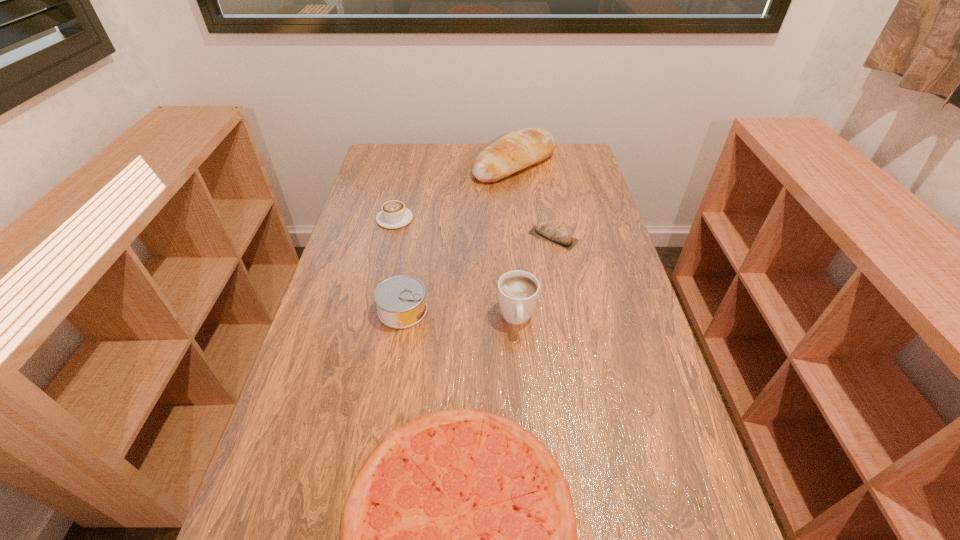
At what (x,y) coordinates should I click in order to perform the action: click on bread. Please return your answer as a coordinate pair (x, y). The height and width of the screenshot is (540, 960). Looking at the image, I should click on (517, 150).

Find the location of a particular element. This screenshot has height=540, width=960. the nearer cappuccino is located at coordinates (518, 291).

In order to click on the right cappuccino in this screenshot , I will do `click(518, 291)`.

Where is `can`? This screenshot has width=960, height=540. can is located at coordinates (400, 300).

This screenshot has height=540, width=960. Find the location of `the farther cappuccino`. the farther cappuccino is located at coordinates (393, 214).

Identify the location of the shorter cappuccino. (393, 214).

At what (x,y) coordinates should I click in order to perform the action: click on pita bread. Please return your answer as a coordinate pair (x, y). The height and width of the screenshot is (540, 960). Looking at the image, I should click on (544, 230).

You are a GUI agent. You are given a task and a screenshot of the screen. Output one action in this format:
    pyautogui.click(x=<x>, y=<y>)
    Task: Click on the free space located 0.260m on the front of the farthest object
    The image size is (960, 540).
    Given the screenshot: What is the action you would take?
    pyautogui.click(x=521, y=231)

Find the location of a particular element. Image resolution: width=960 pixels, height=540 pixels. vacant region located with the handle on the side of the taller cappuccino is located at coordinates (524, 417).

In order to click on free location located on the back of the can in this screenshot , I will do `click(415, 239)`.